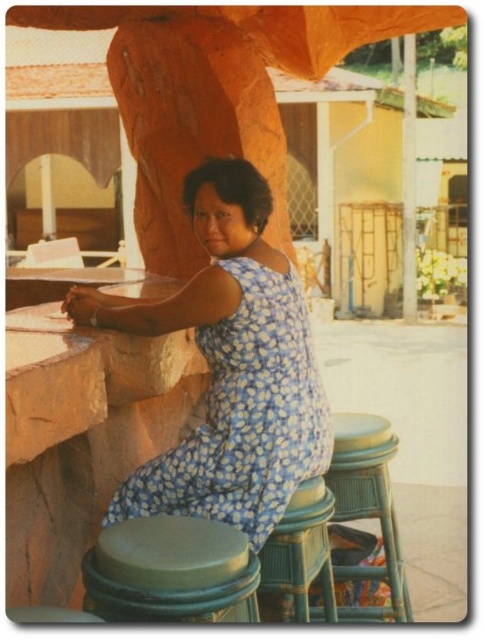
You are a person who is 160 cm tall and want to sit comfortably on one of the stools. Which stool between the green rubber bar stool at lower center and the teal wood bar stool at lower center would be more suitable for you?

The green rubber bar stool at lower center has a lesser height compared to the teal wood bar stool at lower center, so the green rubber bar stool at lower center would be more suitable for someone of 160 cm in height as it is shorter and offers a better seating position.

You are sitting at the teal wood bar stool at lower center and want to hand a menu to the person wearing the blue floral fabric dress at center. In which direction should you pass the menu?

The blue floral fabric dress at center is to the left of the teal wood bar stool at lower center, so you should pass the menu to the left.

Consider the image. You are a server at the outdoor cafe and need to place a 4.5 meter long banner between the green rubber bar stool at lower center and the teal wood bar stool at lower center. Can the banner fit between them?

The distance between the green rubber bar stool at lower center and the teal wood bar stool at lower center is 4.35 meters. Since the banner is 4.5 meters long, it is slightly longer than the available space, so the banner cannot fit between them.